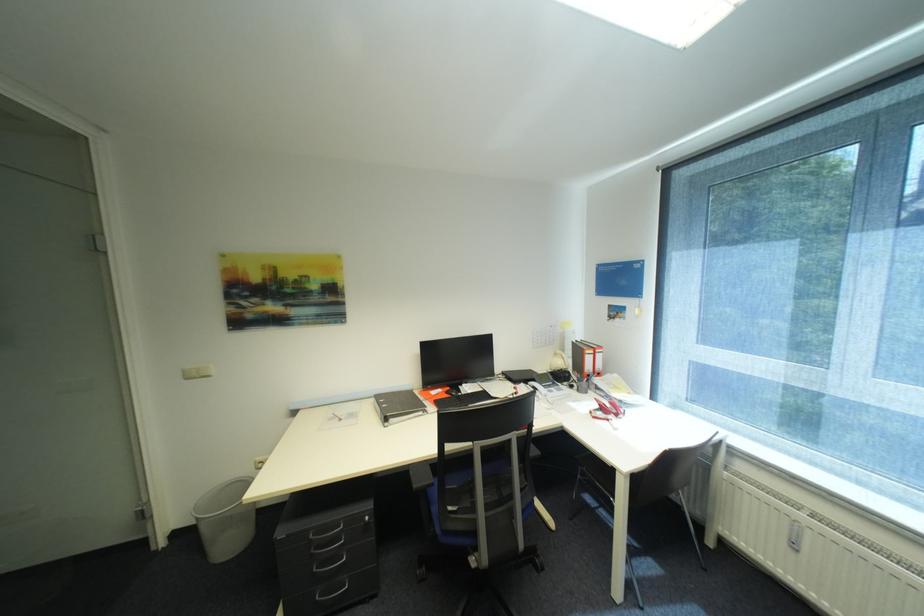
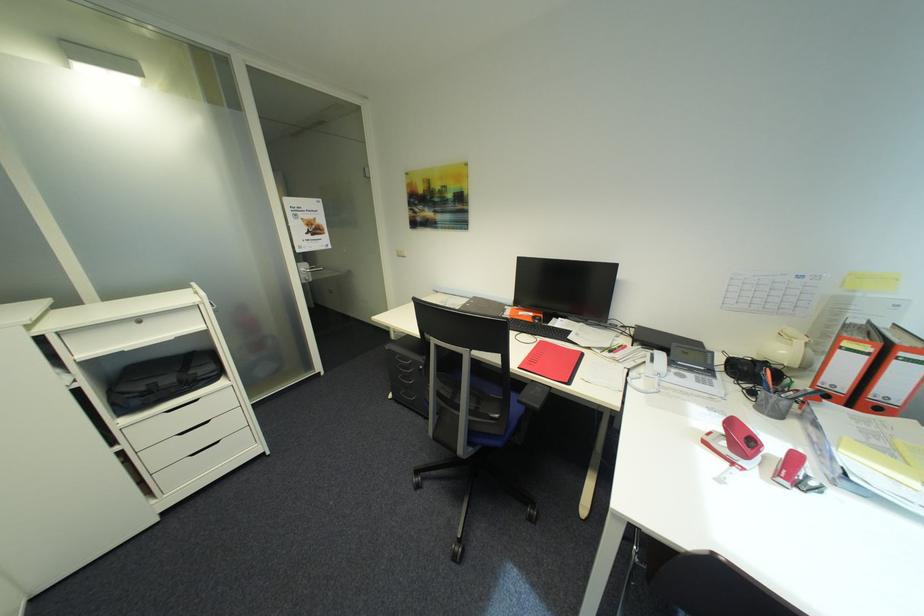
Locate, in the second image, the point that corresponds to point (615, 419) in the first image.

(742, 464)